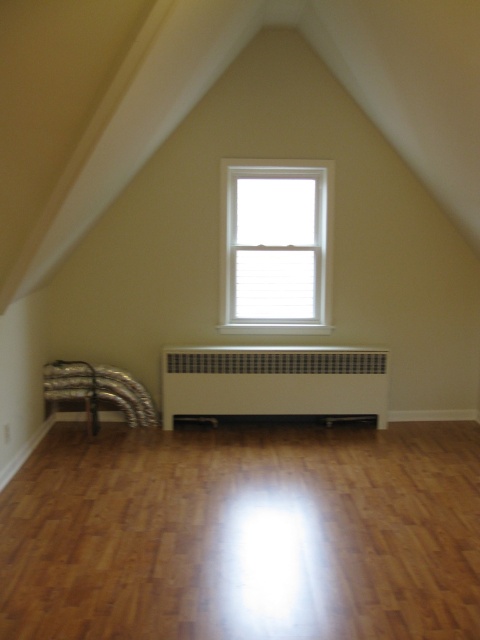
Does light brown wood floor at center have a greater width compared to white matte window at center?

Yes, light brown wood floor at center is wider than white matte window at center.

Who is positioned more to the right, light brown wood floor at center or white matte window at center?

white matte window at center

Is point (27, 618) farther from viewer compared to point (313, 250)?

No, it is not.

This screenshot has height=640, width=480. What are the coordinates of `light brown wood floor at center` in the screenshot? It's located at (244, 532).

Is white matte window at center further to the viewer compared to white matte radiator at center?

Yes, it is behind white matte radiator at center.

The width and height of the screenshot is (480, 640). What are the coordinates of `white matte window at center` in the screenshot? It's located at (276, 246).

Is point (229, 188) positioned in front of point (360, 369)?

No, (229, 188) is further to viewer.

At what (x,y) coordinates should I click in order to perform the action: click on white matte window at center. Please return your answer as a coordinate pair (x, y). The width and height of the screenshot is (480, 640). Looking at the image, I should click on (276, 246).

Looking at this image, does white matte window at center have a smaller size compared to silver reflective ducts at lower left?

Incorrect, white matte window at center is not smaller in size than silver reflective ducts at lower left.

Is white matte window at center positioned in front of silver reflective ducts at lower left?

No.

Locate an element on the screen. white matte window at center is located at coordinates (276, 246).